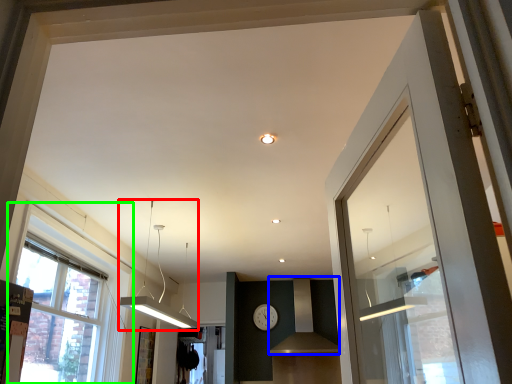
Question: Which is farther away from light fixture (highlighted by a red box)? vent (highlighted by a blue box) or window (highlighted by a green box)?

Choices:
 (A) vent
 (B) window

Answer: (A)